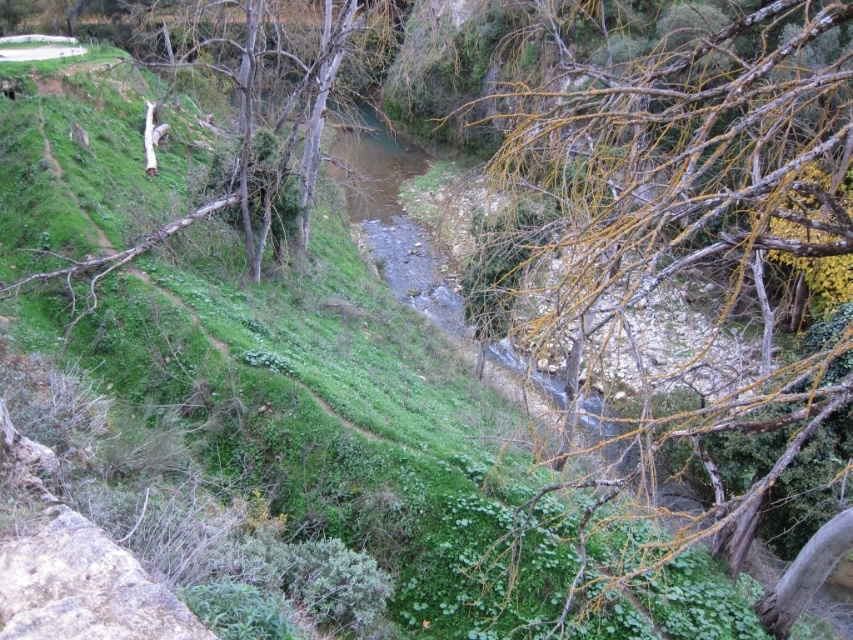
Question: Is yellowish-brown branches at center thinner than brown wood tree at upper left?

Choices:
 (A) yes
 (B) no

Answer: (B)

Question: Considering the relative positions of yellowish-brown branches at center and brown wood tree at upper left in the image provided, where is yellowish-brown branches at center located with respect to brown wood tree at upper left?

Choices:
 (A) above
 (B) below

Answer: (B)

Question: Does yellowish-brown branches at center lie behind brown wood tree at upper left?

Choices:
 (A) no
 (B) yes

Answer: (A)

Question: Which of the following is the closest to the observer?

Choices:
 (A) brown wood tree at upper left
 (B) yellowish-brown branches at center

Answer: (B)